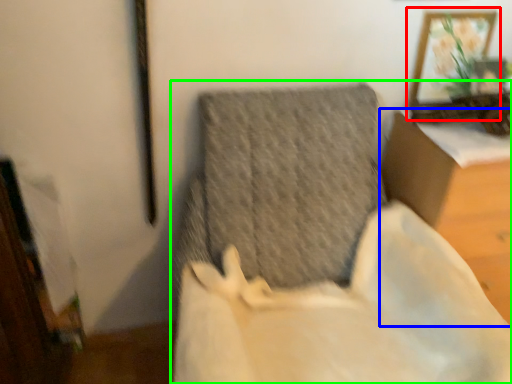
Question: Estimate the real-world distances between objects in this image. Which object is farther from picture frame (highlighted by a red box), furniture (highlighted by a blue box) or furniture (highlighted by a green box)?

Choices:
 (A) furniture
 (B) furniture

Answer: (B)